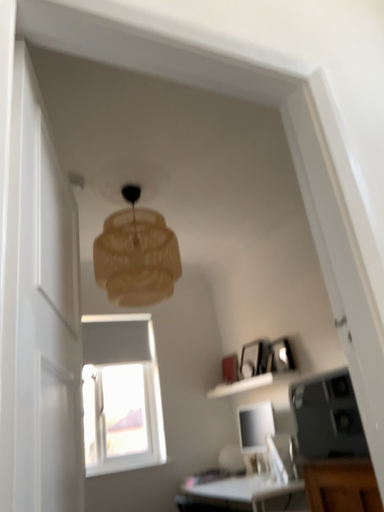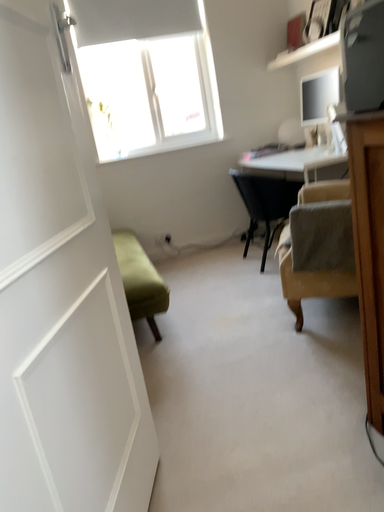
Question: How did the camera likely rotate when shooting the video?

Choices:
 (A) rotated left
 (B) rotated right

Answer: (A)